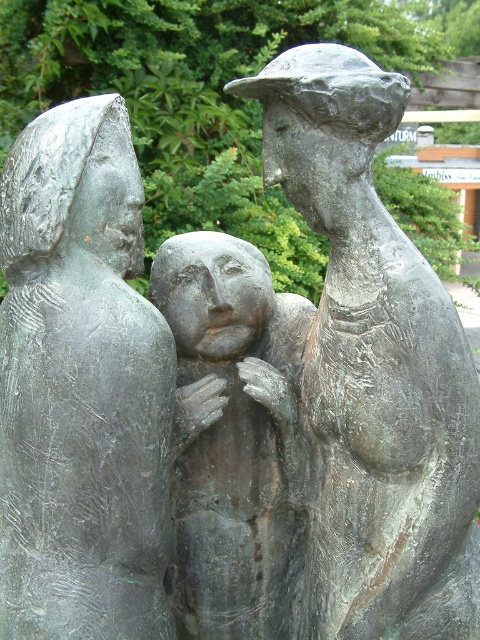
Which is behind, point (27, 541) or point (247, 580)?

The point (247, 580) is more distant.

Is bronze textured figure at left positioned behind bronze sculpture at center?

No.

Describe the element at coordinates (83, 388) in the screenshot. I see `bronze textured figure at left` at that location.

Where is `bronze textured figure at left`? This screenshot has width=480, height=640. bronze textured figure at left is located at coordinates (83, 388).

Is bronze statue at upper right in front of bronze sculpture at center?

Yes, it is in front of bronze sculpture at center.

Which is in front, point (342, 310) or point (202, 589)?

Point (342, 310) is in front.

Image resolution: width=480 pixels, height=640 pixels. What are the coordinates of `bronze statue at upper right` in the screenshot? It's located at (374, 368).

Who is taller, bronze textured figure at left or bronze statue at upper right?

With more height is bronze statue at upper right.

Does bronze textured figure at left have a smaller size compared to bronze statue at upper right?

Yes, bronze textured figure at left is smaller than bronze statue at upper right.

Between point (136, 333) and point (336, 300), which one is positioned in front?

Positioned in front is point (136, 333).

Find the location of a particular element. This screenshot has width=480, height=640. bronze textured figure at left is located at coordinates (83, 388).